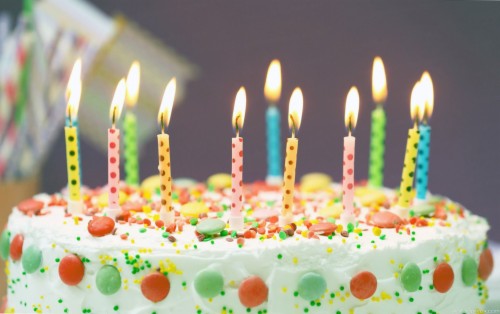
Identify the location of background candles. This screenshot has height=314, width=500. (16, 66), (25, 68), (35, 70), (51, 72), (6, 119), (7, 134), (25, 157), (80, 46), (52, 50).